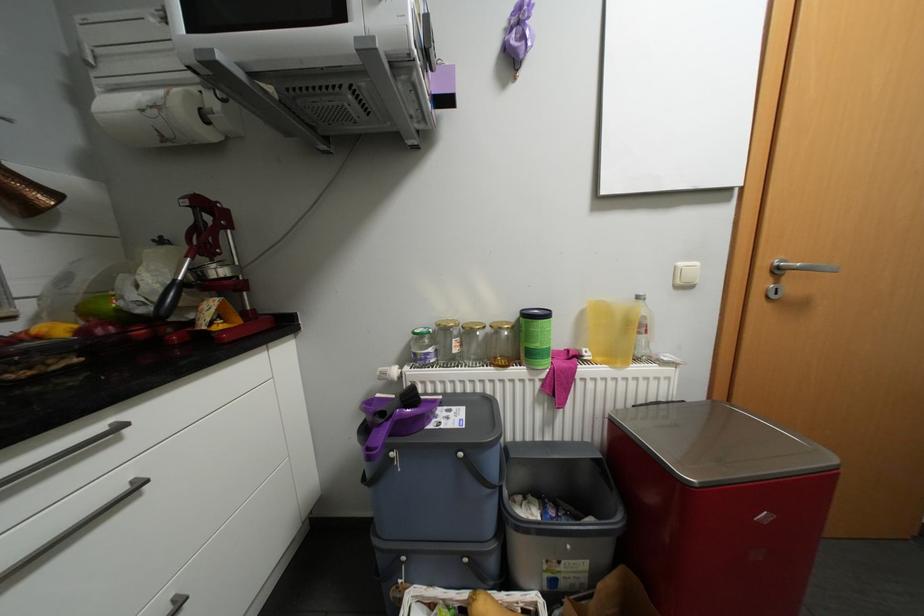
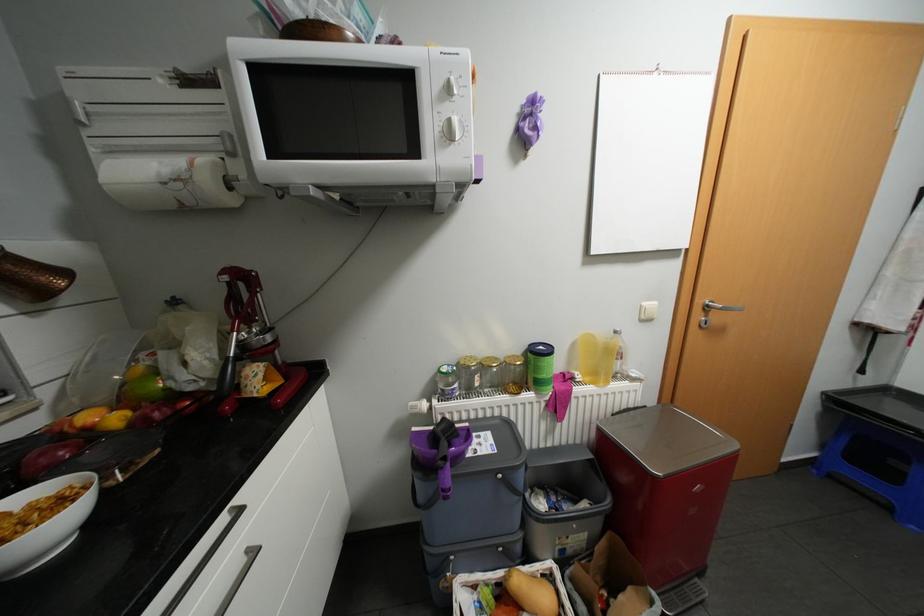
The point at (69, 329) is marked in the first image. Where is the corresponding point in the second image?

(123, 418)